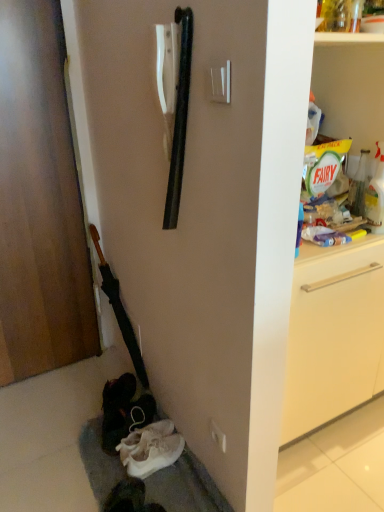
Question: Considering the positions of white fabric shoes at lower left and white plastic electric outlet at center in the image, is white fabric shoes at lower left wider or thinner than white plastic electric outlet at center?

Choices:
 (A) wide
 (B) thin

Answer: (A)

Question: Considering their positions, is white fabric shoes at lower left located in front of or behind white plastic electric outlet at center?

Choices:
 (A) behind
 (B) front

Answer: (B)

Question: Estimate the real-world distances between objects in this image. Which object is farther from the white glossy shelf at upper right?

Choices:
 (A) wooden door at left
 (B) white suede shoe at lower left
 (C) white plastic electric outlet at center
 (D) white fabric shoes at lower left

Answer: (A)

Question: Estimate the real-world distances between objects in this image. Which object is closer to the white suede shoe at lower left?

Choices:
 (A) white fabric shoes at lower left
 (B) white glossy shelf at upper right
 (C) white plastic electric outlet at center
 (D) wooden door at left

Answer: (A)